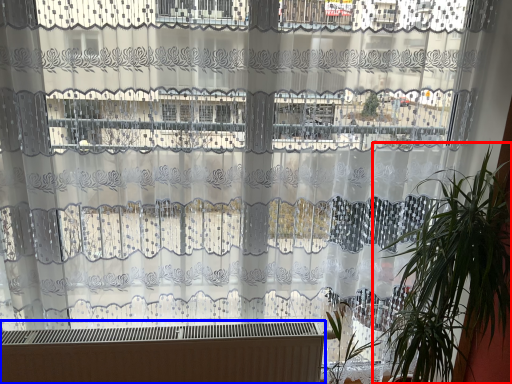
Question: Among these objects, which one is farthest to the camera, houseplant (highlighted by a red box) or heater (highlighted by a blue box)?

Choices:
 (A) houseplant
 (B) heater

Answer: (B)